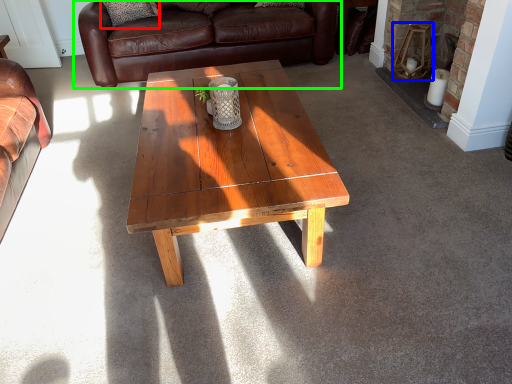
Question: Considering the real-world distances, which object is closest to pillow (highlighted by a red box)? stool (highlighted by a blue box) or studio couch (highlighted by a green box).

Choices:
 (A) stool
 (B) studio couch

Answer: (B)